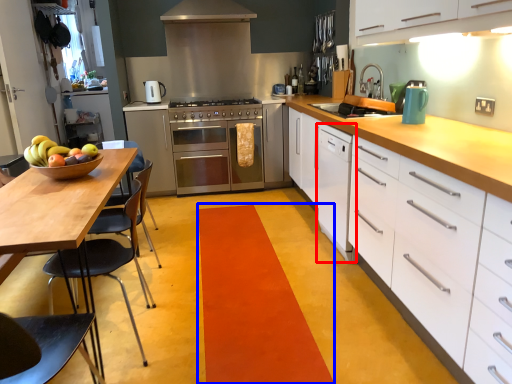
Question: Which object is closer to the camera taking this photo, file cabinet (highlighted by a red box) or plain (highlighted by a blue box)?

Choices:
 (A) file cabinet
 (B) plain

Answer: (B)